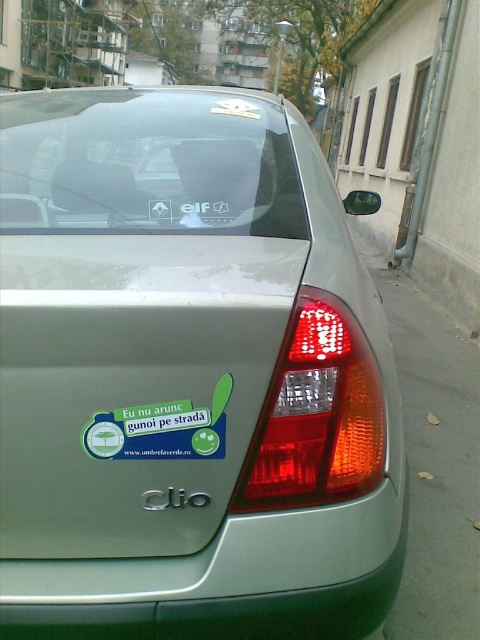
Question: Is satin silver car at center to the right of green sticker at center from the viewer's perspective?

Choices:
 (A) no
 (B) yes

Answer: (B)

Question: Which point is closer to the camera?

Choices:
 (A) green sticker at center
 (B) satin silver car at center

Answer: (B)

Question: Which object is closer to the camera taking this photo?

Choices:
 (A) satin silver car at center
 (B) green sticker at center

Answer: (A)

Question: Can you confirm if satin silver car at center is thinner than green sticker at center?

Choices:
 (A) yes
 (B) no

Answer: (B)

Question: Observing the image, what is the correct spatial positioning of satin silver car at center in reference to green sticker at center?

Choices:
 (A) above
 (B) below

Answer: (A)

Question: Which point is closer to the camera?

Choices:
 (A) (141, 625)
 (B) (183, 444)

Answer: (B)